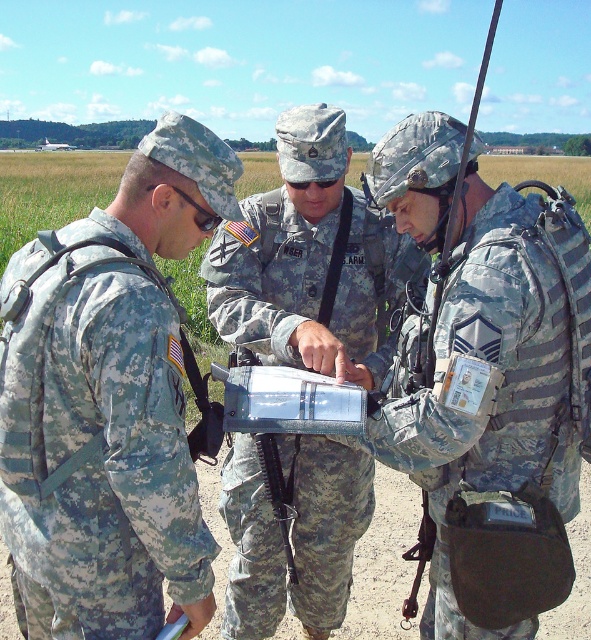
Is camouflage fabric uniform at left shorter than camouflage fabric uniform at center?

No.

Is camouflage fabric uniform at left thinner than camouflage fabric uniform at center?

Indeed, camouflage fabric uniform at left has a lesser width compared to camouflage fabric uniform at center.

Who is more distant from viewer, (92,260) or (280,358)?

The point (280,358) is behind.

Where is `camouflage fabric uniform at left`? camouflage fabric uniform at left is located at coordinates (109, 404).

Is camouflage fabric uniform at left closer to the viewer compared to camouflage fabric backpack at right?

Yes, it is in front of camouflage fabric backpack at right.

Looking at this image, is camouflage fabric uniform at left below camouflage fabric backpack at right?

No, camouflage fabric uniform at left is not below camouflage fabric backpack at right.

This screenshot has width=591, height=640. In order to click on camouflage fabric uniform at left in this screenshot , I will do `click(109, 404)`.

This screenshot has width=591, height=640. Find the location of `camouflage fabric uniform at left`. camouflage fabric uniform at left is located at coordinates click(109, 404).

Does camouflage fabric backpack at right appear on the left side of camouflage fabric uniform at center?

No, camouflage fabric backpack at right is not to the left of camouflage fabric uniform at center.

Is camouflage fabric backpack at right above camouflage fabric uniform at center?

No.

Locate an element on the screen. camouflage fabric backpack at right is located at coordinates (493, 378).